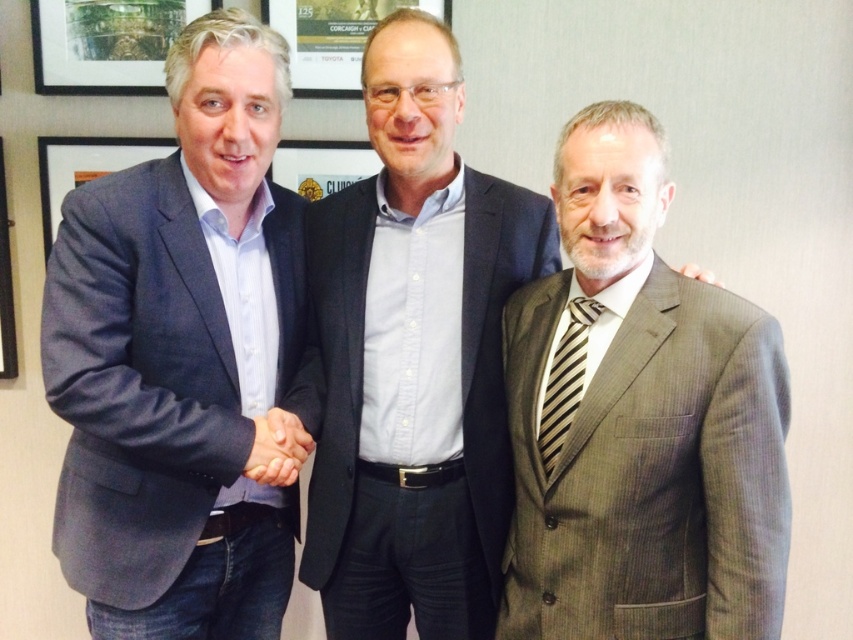
You are a tailor observing the three men in the professional setting. You need to determine which suit has a greater width between the matte blue suit at left and the gray textured suit at right based on the image. Which one is wider?

The matte blue suit at left is wider than the gray textured suit at right according to the description.